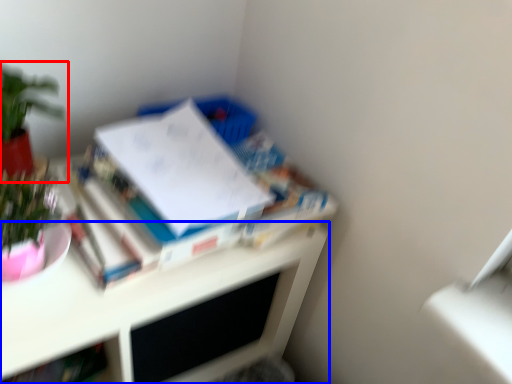
Question: Which of the following is the farthest to the observer, houseplant (highlighted by a red box) or desk (highlighted by a blue box)?

Choices:
 (A) houseplant
 (B) desk

Answer: (A)